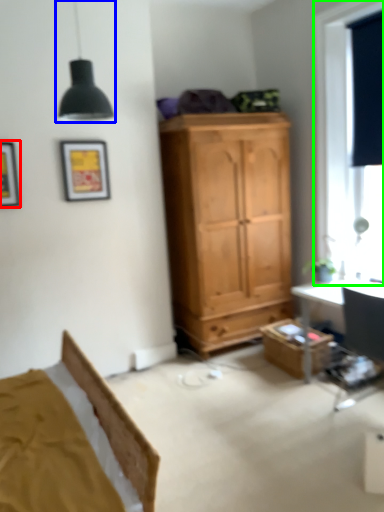
Question: Based on their relative distances, which object is farther from picture frame (highlighted by a red box)? Choose from light fixture (highlighted by a blue box) and window (highlighted by a green box).

Choices:
 (A) light fixture
 (B) window

Answer: (B)